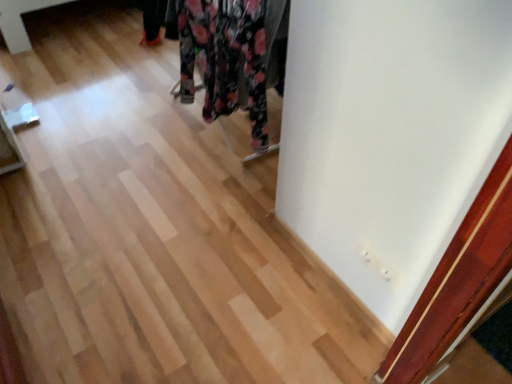
Find the location of a particular element. The width and height of the screenshot is (512, 384). floral fabric dress at center is located at coordinates (226, 58).

Describe the element at coordinates (226, 58) in the screenshot. I see `floral fabric dress at center` at that location.

This screenshot has width=512, height=384. I want to click on floral fabric dress at center, so click(x=226, y=58).